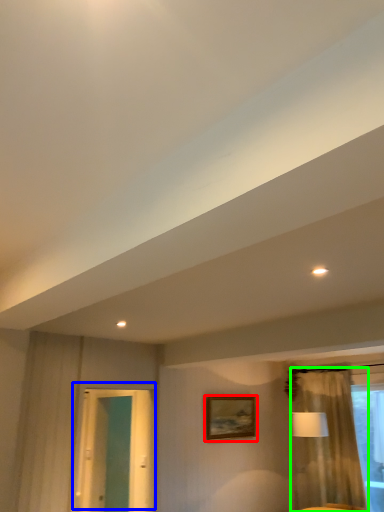
Question: Which object is the farthest from picture frame (highlighted by a red box)? Choose among these: door (highlighted by a blue box) or curtain (highlighted by a green box).

Choices:
 (A) door
 (B) curtain

Answer: (A)